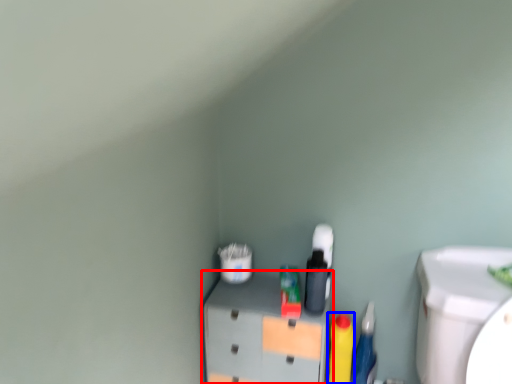
Question: Which of the following is the closest to the observer, furniture (highlighted by a red box) or cleaning product (highlighted by a blue box)?

Choices:
 (A) furniture
 (B) cleaning product

Answer: (A)